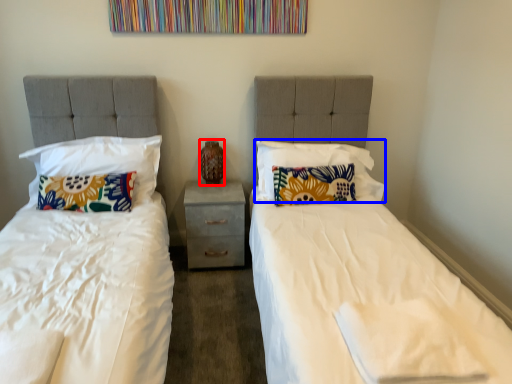
Question: Among these objects, which one is farthest to the camera, vase (highlighted by a red box) or pillow (highlighted by a blue box)?

Choices:
 (A) vase
 (B) pillow

Answer: (A)